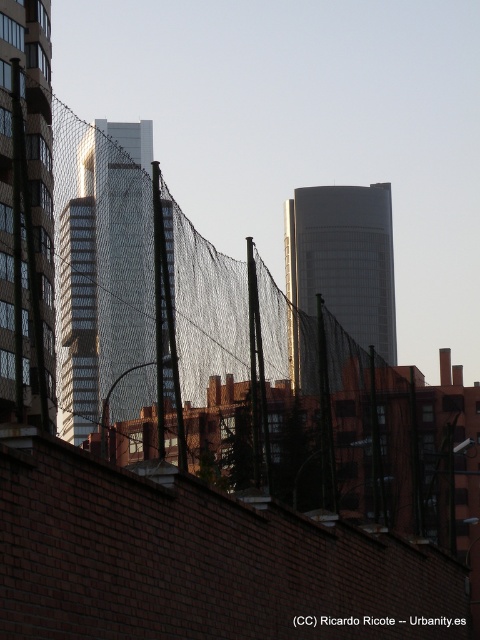
You are standing at the origin point of the image. Which direction should you move to reach the matte glass skyscraper at left?

You should move towards the left and slightly upwards since the matte glass skyscraper at left is located at point 0.336 on the x and 0.054 on the y axis.

You are a drone operator who needs to fly a drone between the matte glass skyscraper at left and the smooth glass tower at center. The drone has a maximum flight distance of 500 feet. Can the drone safely fly between them without exceeding its range?

The matte glass skyscraper at left is 485.12 feet from the smooth glass tower at center. Since the drone can fly up to 500 feet, it can safely fly between them as the distance is within its range.

You are an architect evaluating the urban layout. You notice two structures in the image, the smooth glass skyscraper at center and the smooth glass tower at center. Which one has a greater height?

The smooth glass skyscraper at center is larger in size than the smooth glass tower at center, so it has a greater height.